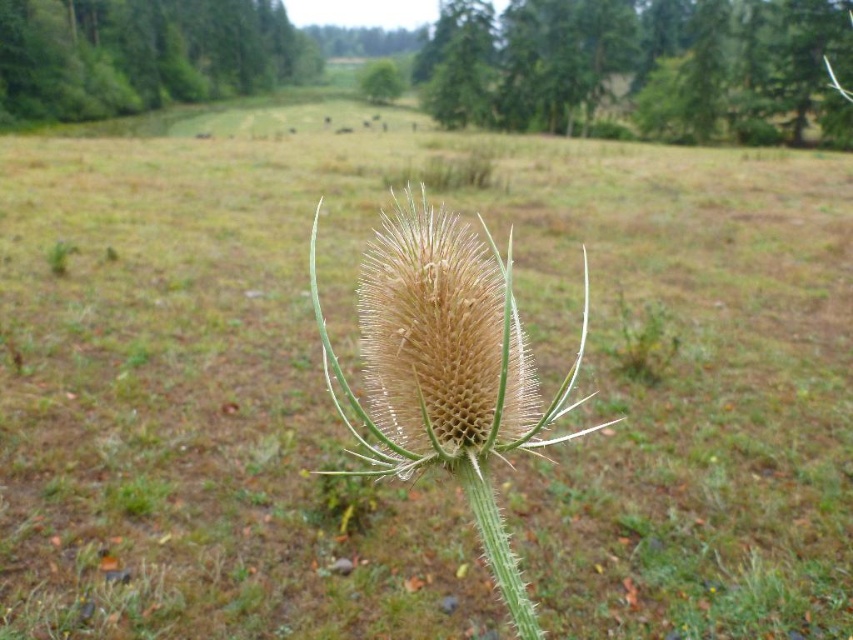
Can you confirm if green fuzzy tree at upper left is bigger than green spiny stem at center?

Yes.

Can you confirm if green fuzzy tree at upper left is taller than green spiny stem at center?

Yes, green fuzzy tree at upper left is taller than green spiny stem at center.

At what (x,y) coordinates should I click in order to perform the action: click on green fuzzy tree at upper left. Please return your answer as a coordinate pair (x, y). Looking at the image, I should click on (142, 54).

Where is `green fuzzy tree at upper left`? This screenshot has height=640, width=853. green fuzzy tree at upper left is located at coordinates (142, 54).

Who is positioned more to the right, brown fuzzy thistle at center or green fuzzy tree at upper left?

brown fuzzy thistle at center

Who is more distant from viewer, (424, 294) or (155, 97)?

The point (155, 97) is more distant.

Locate an element on the screen. The height and width of the screenshot is (640, 853). brown fuzzy thistle at center is located at coordinates (440, 348).

Does green textured tree at upper center have a lesser width compared to green fuzzy tree at upper left?

In fact, green textured tree at upper center might be wider than green fuzzy tree at upper left.

Is green textured tree at upper center positioned behind green fuzzy tree at upper left?

No.

Image resolution: width=853 pixels, height=640 pixels. In order to click on green textured tree at upper center in this screenshot , I will do `click(641, 65)`.